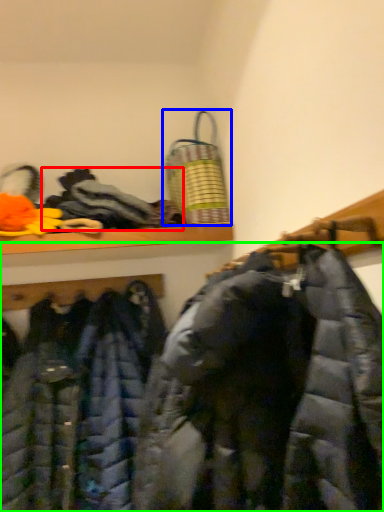
Question: Which is farther away from cloak (highlighted by a red box)? laundry basket (highlighted by a blue box) or jacket (highlighted by a green box)?

Choices:
 (A) laundry basket
 (B) jacket

Answer: (B)